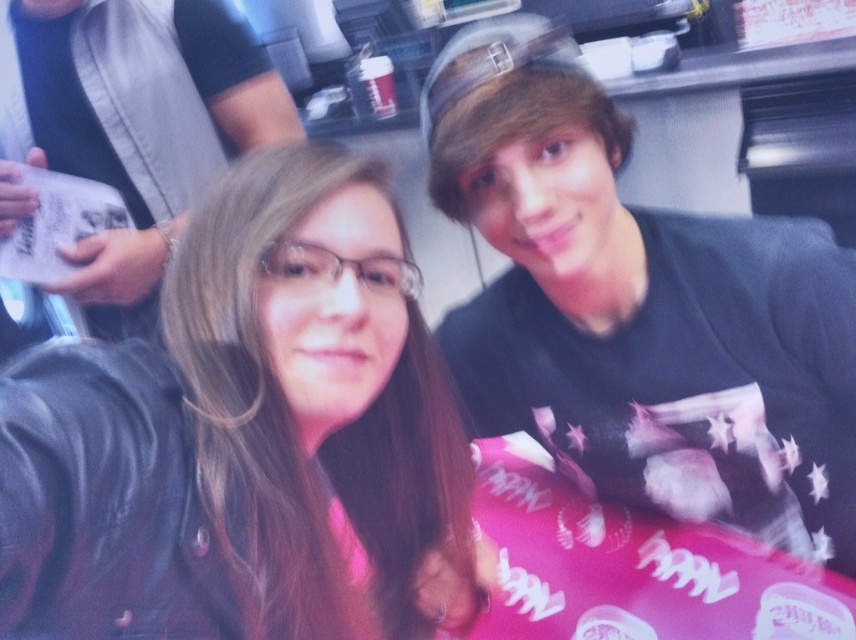
Question: Which object is closer to the camera taking this photo?

Choices:
 (A) matte black jacket at center
 (B) matte black hair at left

Answer: (A)

Question: From the image, what is the correct spatial relationship of matte black jacket at center in relation to black matte shirt at upper right?

Choices:
 (A) right
 (B) left

Answer: (B)

Question: Which point is closer to the camera?

Choices:
 (A) black matte shirt at upper right
 (B) matte black jacket at center
 (C) matte black hair at left

Answer: (B)

Question: Can you confirm if matte black jacket at center is smaller than matte black hair at left?

Choices:
 (A) yes
 (B) no

Answer: (B)

Question: Is matte black jacket at center thinner than matte black hair at left?

Choices:
 (A) yes
 (B) no

Answer: (A)

Question: Based on their relative distances, which object is farther from the black matte shirt at upper right?

Choices:
 (A) matte black hair at left
 (B) matte black jacket at center

Answer: (A)